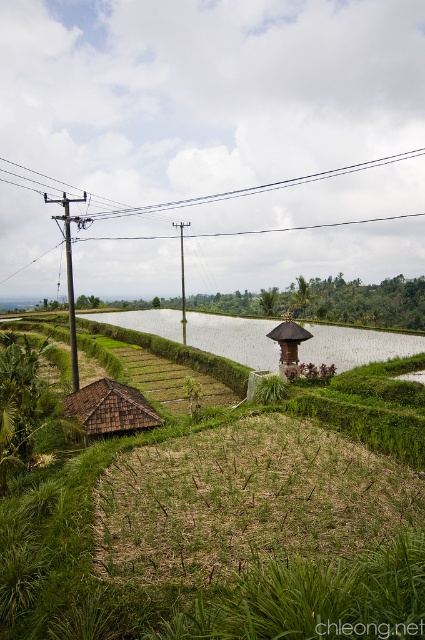
Question: Does brown thatched hut at lower left appear on the left side of brown wooden telegraph pole at center?

Choices:
 (A) no
 (B) yes

Answer: (A)

Question: Which point is farther to the camera?

Choices:
 (A) brown wooden telegraph pole at center
 (B) green grassy rice field at center
 (C) brown wooden telegraph pole at left

Answer: (A)

Question: Can you confirm if white smooth water at center is bigger than brown thatched hut at lower left?

Choices:
 (A) no
 (B) yes

Answer: (B)

Question: Is brown thatched hut at lower left wider than brown wooden telegraph pole at center?

Choices:
 (A) yes
 (B) no

Answer: (B)

Question: Which is nearer to the brown wooden telegraph pole at center?

Choices:
 (A) brown thatched hut at lower left
 (B) green grassy rice field at center
 (C) brown wooden hut at center
 (D) white smooth water at center

Answer: (D)

Question: Which point is farther to the camera?

Choices:
 (A) brown wooden telegraph pole at center
 (B) white smooth water at center

Answer: (A)